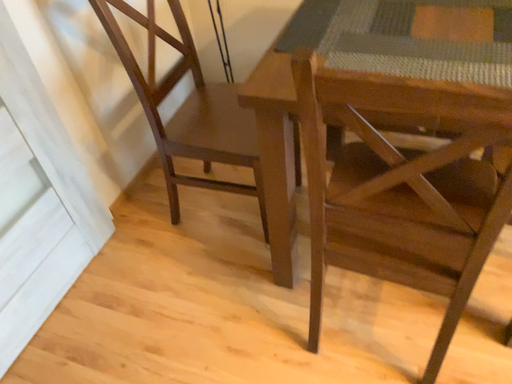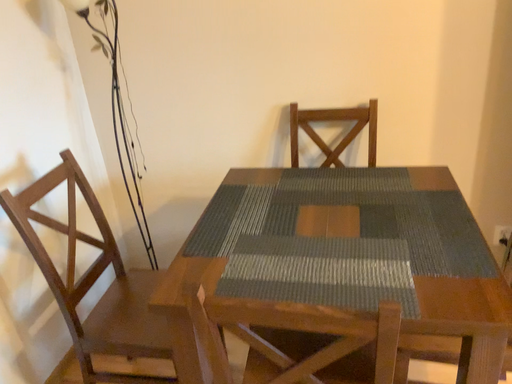
Question: Which way did the camera rotate in the video?

Choices:
 (A) rotated downward
 (B) rotated upward

Answer: (B)